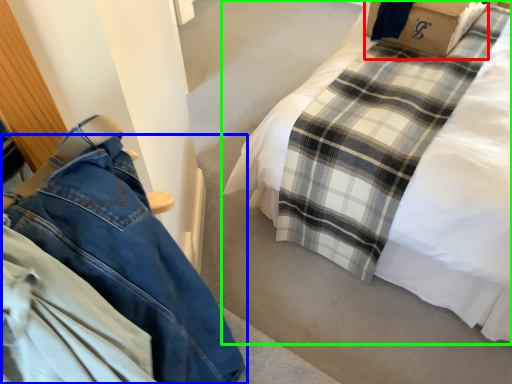
Question: Which object is the farthest from cardboard box (highlighted by a red box)? Choose among these: trousers (highlighted by a blue box) or bed (highlighted by a green box).

Choices:
 (A) trousers
 (B) bed

Answer: (A)